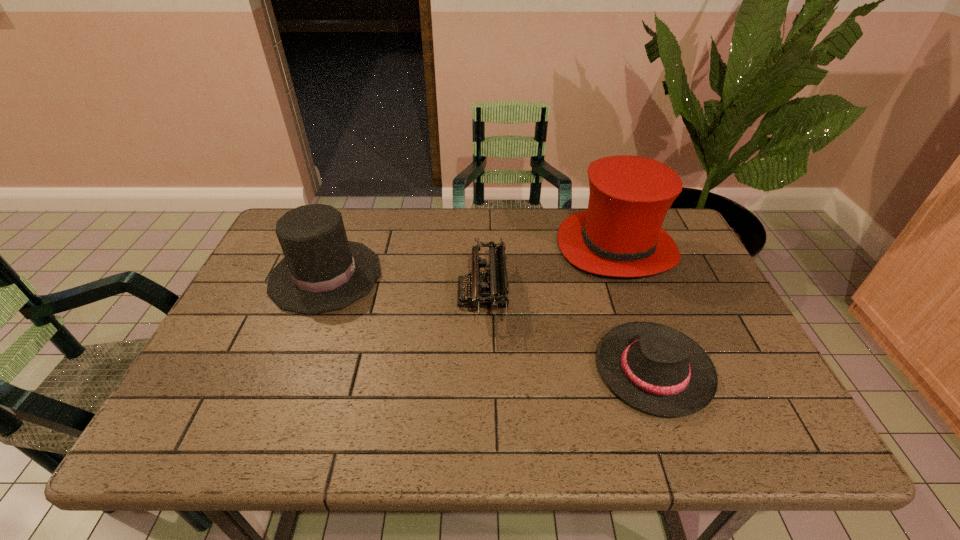
Image resolution: width=960 pixels, height=540 pixels. Identify the location of empty location between the second shortest dress hat and the typewriter. (404, 285).

Where is `object that stands as the second closest to the leftmost dress hat`? object that stands as the second closest to the leftmost dress hat is located at coordinates (620, 235).

Locate which object is the closest to the typewriter. Please provide its 2D coordinates. Your answer should be formatted as a tuple, i.e. [(x, y)], where the tuple contains the x and y coordinates of a point satisfying the conditions above.

[(620, 235)]

Identify which dress hat is located as the second nearest to the third object from right to left. Please provide its 2D coordinates. Your answer should be formatted as a tuple, i.e. [(x, y)], where the tuple contains the x and y coordinates of a point satisfying the conditions above.

[(657, 369)]

The height and width of the screenshot is (540, 960). What are the coordinates of `dress hat that is the nearest to the leftmost object` in the screenshot? It's located at (620, 235).

Find the location of `free space that satisfies the following two spatial constraints: 1. on the typing side of the third object from right to left; 2. on the right side of the nearest dress hat`. free space that satisfies the following two spatial constraints: 1. on the typing side of the third object from right to left; 2. on the right side of the nearest dress hat is located at coordinates (483, 370).

The height and width of the screenshot is (540, 960). In order to click on vacant space that satisfies the following two spatial constraints: 1. on the typing side of the shortest dress hat; 2. on the left side of the second object from left to right in this screenshot , I will do `click(483, 370)`.